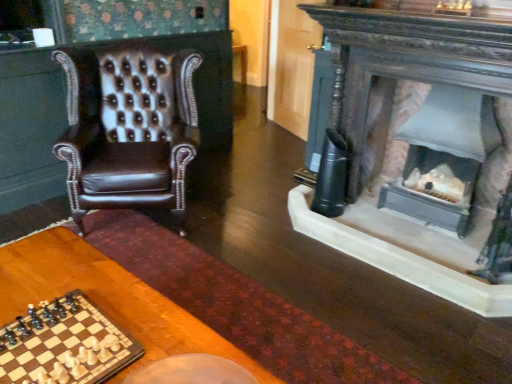
Question: Does brown leather chair at left have a smaller size compared to wooden chessboard at lower left?

Choices:
 (A) no
 (B) yes

Answer: (A)

Question: Can you confirm if brown leather chair at left is positioned to the left of wooden chessboard at lower left?

Choices:
 (A) no
 (B) yes

Answer: (B)

Question: Does brown leather chair at left appear on the right side of wooden chessboard at lower left?

Choices:
 (A) no
 (B) yes

Answer: (A)

Question: Considering the relative sizes of brown leather chair at left and wooden chessboard at lower left in the image provided, is brown leather chair at left taller than wooden chessboard at lower left?

Choices:
 (A) no
 (B) yes

Answer: (B)

Question: From the image's perspective, is brown leather chair at left located beneath wooden chessboard at lower left?

Choices:
 (A) no
 (B) yes

Answer: (A)

Question: Is brown leather chair at left outside wooden chessboard at lower left?

Choices:
 (A) no
 (B) yes

Answer: (B)

Question: Is wooden chessboard at lower left positioned before brown leather chair at left?

Choices:
 (A) yes
 (B) no

Answer: (A)

Question: Is wooden chessboard at lower left facing towards brown leather chair at left?

Choices:
 (A) no
 (B) yes

Answer: (A)

Question: Does wooden chessboard at lower left have a greater height compared to brown leather chair at left?

Choices:
 (A) yes
 (B) no

Answer: (B)

Question: Is brown leather chair at left located within wooden chessboard at lower left?

Choices:
 (A) yes
 (B) no

Answer: (B)

Question: Can you confirm if wooden chessboard at lower left is shorter than brown leather chair at left?

Choices:
 (A) yes
 (B) no

Answer: (A)

Question: Is wooden chessboard at lower left beside brown leather chair at left?

Choices:
 (A) yes
 (B) no

Answer: (B)

Question: Can you confirm if wooden chessboard at lower left is positioned to the left of wooden table at lower left?

Choices:
 (A) no
 (B) yes

Answer: (B)